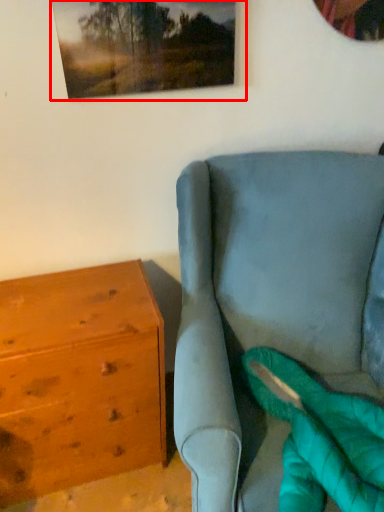
Question: Considering the relative positions of picture frame (annotated by the red box) and chest of drawers in the image provided, where is picture frame (annotated by the red box) located with respect to the staircase?

Choices:
 (A) right
 (B) left

Answer: (A)